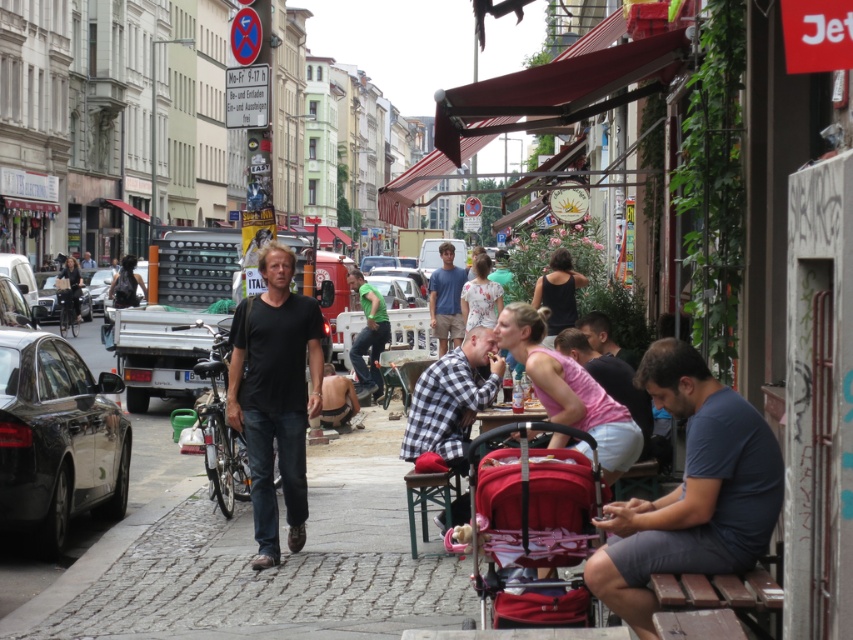
Question: Which of these objects is positioned closest to the matte red stroller at center?

Choices:
 (A) dark blue t-shirt at center
 (B) matte black car at left

Answer: (A)

Question: Does matte red stroller at center have a larger size compared to matte black car at left?

Choices:
 (A) no
 (B) yes

Answer: (B)

Question: Which object is positioned closest to the shiny black car at left?

Choices:
 (A) matte red stroller at center
 (B) matte black car at left

Answer: (A)

Question: Does matte red stroller at center have a lesser width compared to blue cotton shirt at center?

Choices:
 (A) no
 (B) yes

Answer: (B)

Question: Which is nearer to the shiny silver car at left?

Choices:
 (A) dark blue t-shirt at center
 (B) dark blue shirt at center
 (C) blue cotton shirt at center

Answer: (C)

Question: Does shiny black car at left appear on the right side of green matte shirt at center?

Choices:
 (A) yes
 (B) no

Answer: (B)